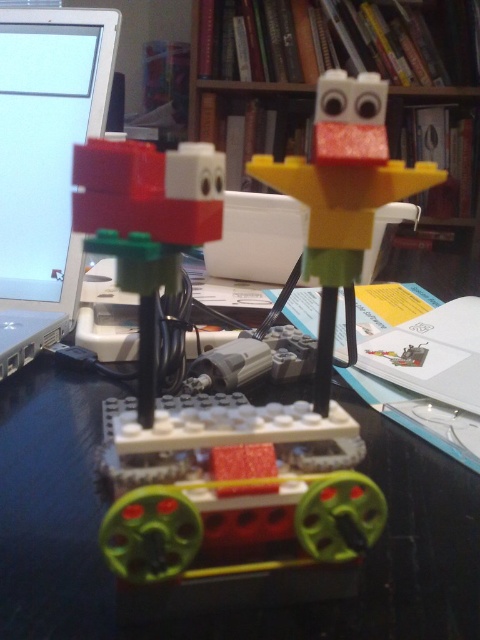
Does matte silver laptop at left have a larger size compared to brick red plastic block at center?

Actually, matte silver laptop at left might be smaller than brick red plastic block at center.

The height and width of the screenshot is (640, 480). I want to click on matte silver laptop at left, so click(46, 164).

Between point (27, 118) and point (118, 264), which one is positioned behind?

Positioned behind is point (27, 118).

Find the location of `matte silver laptop at left`. matte silver laptop at left is located at coordinates (46, 164).

Is wooden bookshelf at upper center positioned in front of yellow matte plastic bird at upper center?

That is False.

Describe the element at coordinates (418, 93) in the screenshot. I see `wooden bookshelf at upper center` at that location.

Measure the distance between wooden bookshelf at upper center and camera.

The distance of wooden bookshelf at upper center from camera is 2.16 meters.

Locate an element on the screen. The width and height of the screenshot is (480, 640). wooden bookshelf at upper center is located at coordinates (418, 93).

At what (x,y) coordinates should I click in order to perform the action: click on matte silver laptop at left. Please return your answer as a coordinate pair (x, y). The height and width of the screenshot is (640, 480). Looking at the image, I should click on (46, 164).

Between matte silver laptop at left and yellow matte plastic bird at upper center, which one appears on the left side from the viewer's perspective?

From the viewer's perspective, matte silver laptop at left appears more on the left side.

Identify the location of matte silver laptop at left. click(x=46, y=164).